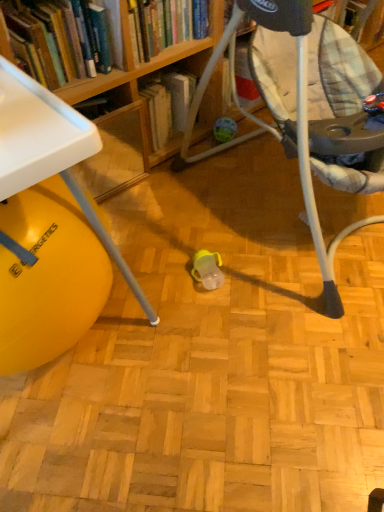
The image size is (384, 512). What are the coordinates of `empty space that is to the right of white plastic table at lower left` in the screenshot? It's located at (201, 323).